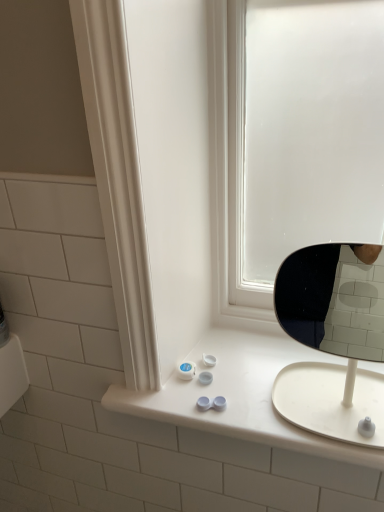
This screenshot has width=384, height=512. What are the coordinates of `blank space situated above white plastic counter top at center (from a real-world perspective)` in the screenshot? It's located at (263, 372).